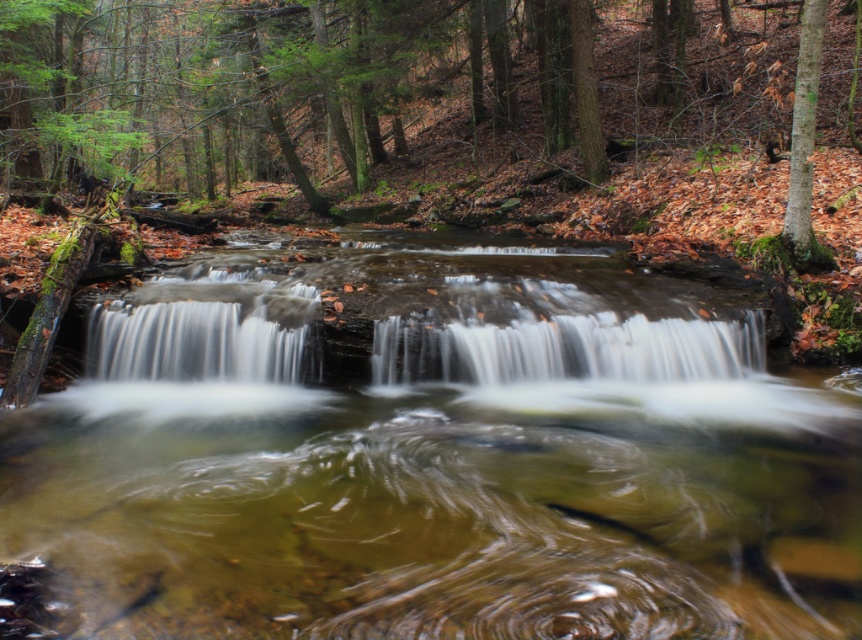
Question: Which of the following is the farthest from the observer?

Choices:
 (A) (791, 163)
 (B) (219, 308)

Answer: (A)

Question: From the image, what is the correct spatial relationship of white frothy water at center in relation to white smooth waterfall at center?

Choices:
 (A) right
 (B) left

Answer: (A)

Question: Is translucent brown water at center thinner than white frothy water at center?

Choices:
 (A) yes
 (B) no

Answer: (A)

Question: Estimate the real-world distances between objects in this image. Which object is farther from the green mossy bark tree at upper right?

Choices:
 (A) white frothy water at center
 (B) white smooth waterfall at center

Answer: (B)

Question: Is translucent brown water at center in front of white smooth waterfall at center?

Choices:
 (A) no
 (B) yes

Answer: (B)

Question: Which object appears closest to the camera in this image?

Choices:
 (A) white smooth waterfall at center
 (B) white frothy water at center
 (C) translucent brown water at center

Answer: (C)